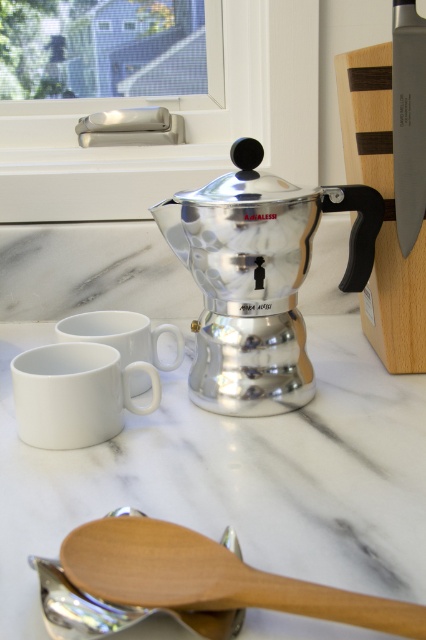
Looking at this image, you are standing in front of the kitchen countertop scene described. You want to place a small decorative item between the two points, point (261, 564) and point (141, 326). Which point should you place it closer to in order to make the item appear larger in your view?

You should place the decorative item closer to point (261, 564) because it is closer to the viewer than point (141, 326). Objects placed closer to the viewer appear larger.

You are preparing coffee in the kitchen and need to place the white glossy mug at lower left closer to the shiny metallic coffee pot at center. Which direction should you move the mug?

You should move the white glossy mug at lower left to the right to place it closer to the shiny metallic coffee pot at center since the coffee pot is to the right of the mug.

You are a barista preparing coffee and need to place the white glossy mug at lower left and the white matte mug at center on a shelf. Which mug should you place first to ensure the other is visible behind it?

You should place the white matte mug at center first, then place the white glossy mug at lower left in front of it so that the matte mug remains visible behind.